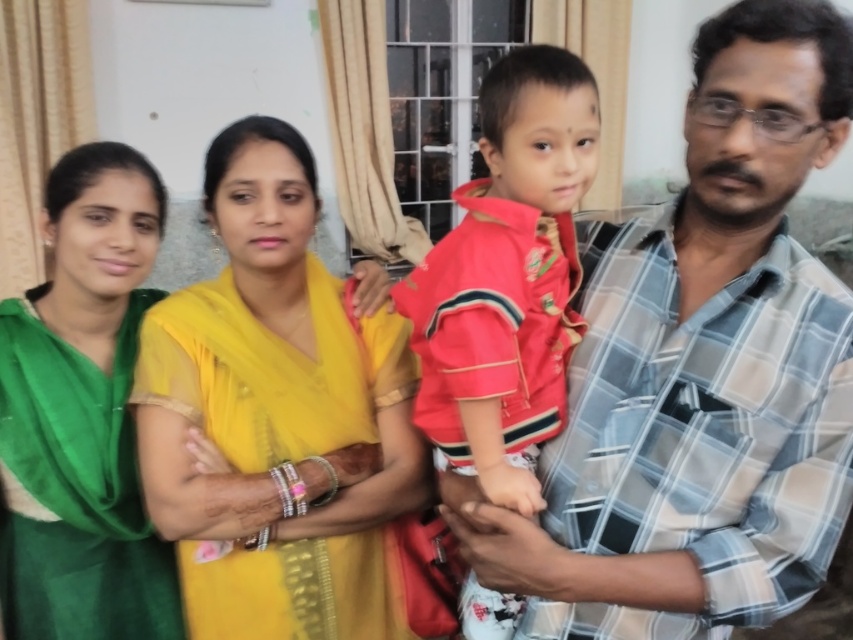
You are a photographer setting up a photo shoot in a small studio. The two main subjects are wearing the yellow sheer saree at center and the red cotton shirt at center. You need to position them side by side so that their garments don not overlap. Given the space constraints, which garment requires more horizontal space due to its width?

The yellow sheer saree at center requires more horizontal space because its width surpasses that of the red cotton shirt at center.

In the family photo, you notice the green silk saree at upper left and the red cotton shirt at center. Which clothing item is positioned to the left of the other?

The green silk saree at upper left is positioned to the left of the red cotton shirt at center.

You are trying to decide which clothing item takes up more space in the photo. Looking at the yellow sheer saree at center and the red cotton shirt at center, which one is bigger?

The yellow sheer saree at center is larger in size than the red cotton shirt at center, so the yellow sheer saree at center takes up more space in the photo.